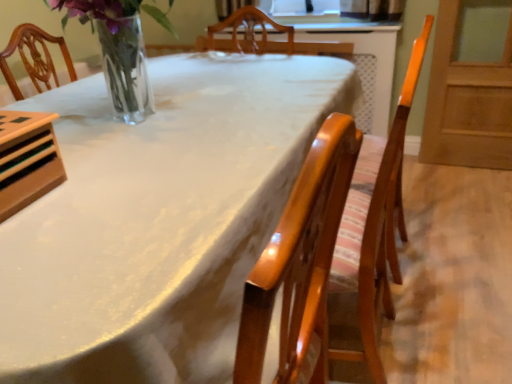
Question: Is white glossy table at center a part of glossy wood chair at center?

Choices:
 (A) yes
 (B) no

Answer: (B)

Question: Can you confirm if glossy wood chair at center is shorter than white glossy table at center?

Choices:
 (A) no
 (B) yes

Answer: (A)

Question: Considering the relative sizes of glossy wood chair at center and white glossy table at center in the image provided, is glossy wood chair at center taller than white glossy table at center?

Choices:
 (A) yes
 (B) no

Answer: (A)

Question: Is glossy wood chair at center placed right next to white glossy table at center?

Choices:
 (A) yes
 (B) no

Answer: (B)

Question: Is glossy wood chair at center smaller than white glossy table at center?

Choices:
 (A) yes
 (B) no

Answer: (A)

Question: Can you confirm if glossy wood chair at center is positioned to the right of white glossy table at center?

Choices:
 (A) no
 (B) yes

Answer: (B)

Question: Considering the relative sizes of white glossy table at center and glossy wood chair at center in the image provided, is white glossy table at center smaller than glossy wood chair at center?

Choices:
 (A) no
 (B) yes

Answer: (A)

Question: From the image's perspective, does white glossy table at center appear lower than glossy wood chair at center?

Choices:
 (A) yes
 (B) no

Answer: (A)

Question: Considering the relative sizes of white glossy table at center and glossy wood chair at center in the image provided, is white glossy table at center thinner than glossy wood chair at center?

Choices:
 (A) yes
 (B) no

Answer: (B)

Question: Does white glossy table at center have a greater width compared to glossy wood chair at center?

Choices:
 (A) no
 (B) yes

Answer: (B)

Question: Would you say white glossy table at center is a long distance from glossy wood chair at center?

Choices:
 (A) yes
 (B) no

Answer: (B)

Question: From a real-world perspective, is white glossy table at center beneath glossy wood chair at center?

Choices:
 (A) yes
 (B) no

Answer: (A)

Question: Would you say white glossy table at center is to the left or to the right of glossy wood chair at center in the picture?

Choices:
 (A) right
 (B) left

Answer: (B)